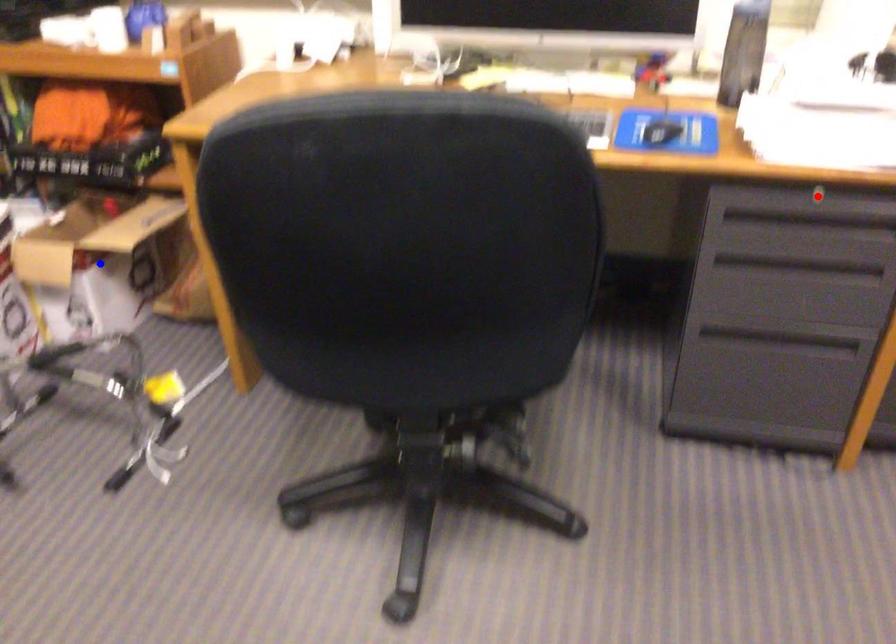
Question: In the image, two points are highlighted. Which point is nearer to the camera? Reply with the corresponding letter.

Choices:
 (A) blue point
 (B) red point

Answer: (B)